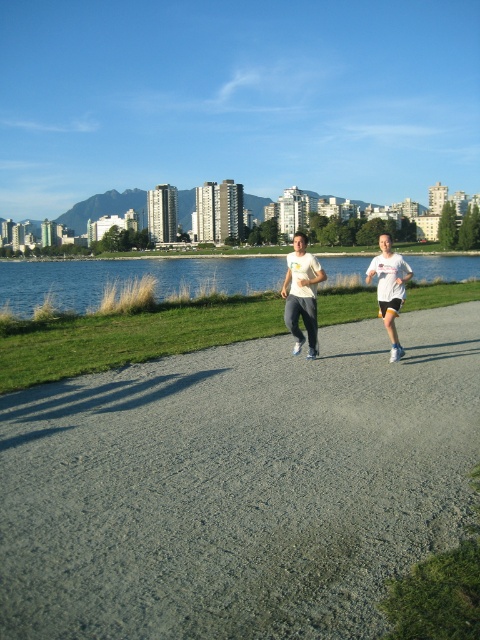
Question: Can you confirm if gray asphalt path at center is bigger than white cotton t-shirt at center?

Choices:
 (A) yes
 (B) no

Answer: (B)

Question: Which point appears farthest from the camera in this image?

Choices:
 (A) (441, 275)
 (B) (389, 320)
 (C) (119, 394)
 (D) (298, 349)

Answer: (A)

Question: Which point is farther to the camera?

Choices:
 (A) white matte t-shirt at center
 (B) white cotton t-shirt at center
 (C) blue water at center

Answer: (C)

Question: Is white cotton t-shirt at center above white matte t-shirt at center?

Choices:
 (A) no
 (B) yes

Answer: (B)

Question: Which object is the farthest from the gray asphalt path at center?

Choices:
 (A) white matte t-shirt at center
 (B) blue water at center
 (C) white matte shirt at center

Answer: (B)

Question: Does gray asphalt path at center appear on the right side of white matte shirt at center?

Choices:
 (A) yes
 (B) no

Answer: (B)